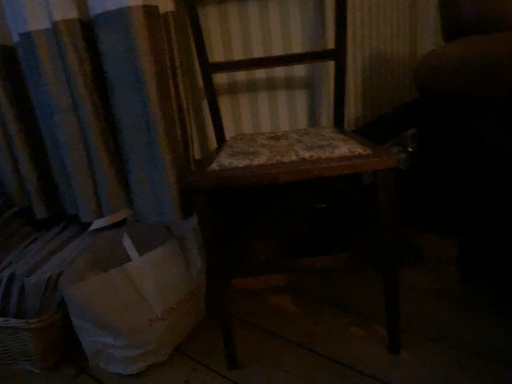
Image resolution: width=512 pixels, height=384 pixels. Describe the element at coordinates (304, 149) in the screenshot. I see `wooden chair at center` at that location.

The height and width of the screenshot is (384, 512). I want to click on wooden chair at center, so click(x=304, y=149).

Describe the element at coordinates (136, 292) in the screenshot. I see `white paper bag at lower left` at that location.

Identify the location of white paper bag at lower left. (136, 292).

The width and height of the screenshot is (512, 384). In order to click on wooden chair at center in this screenshot , I will do `click(304, 149)`.

Is wooden chair at center to the left or to the right of white paper bag at lower left in the image?

wooden chair at center is positioned on white paper bag at lower left's right side.

Relative to white paper bag at lower left, is wooden chair at center in front or behind?

wooden chair at center is positioned closer to the viewer than white paper bag at lower left.

Is point (392, 348) more distant than point (174, 268)?

No, it is in front of (174, 268).

From the image's perspective, between wooden chair at center and white paper bag at lower left, who is located below?

white paper bag at lower left appears lower in the image.

From a real-world perspective, which object stands above the other?

In real-world perspective, wooden chair at center is above.

Does wooden chair at center have a lesser width compared to white paper bag at lower left?

Incorrect, the width of wooden chair at center is not less than that of white paper bag at lower left.

Which of these two, wooden chair at center or white paper bag at lower left, stands taller?

wooden chair at center.

Who is smaller, wooden chair at center or white paper bag at lower left?

Smaller between the two is white paper bag at lower left.

Is wooden chair at center inside the boundaries of white paper bag at lower left, or outside?

wooden chair at center is located beyond the bounds of white paper bag at lower left.

Is wooden chair at center next to white paper bag at lower left?

wooden chair at center and white paper bag at lower left are clearly separated.

Is wooden chair at center turned away from white paper bag at lower left?

No, white paper bag at lower left is not at the back of wooden chair at center.

How many degrees apart are the facing directions of wooden chair at center and white paper bag at lower left?

The angle between the facing direction of wooden chair at center and the facing direction of white paper bag at lower left is 11.5 degrees.

Locate an element on the screen. This screenshot has height=384, width=512. shopping bag below the wooden chair at center (from the image's perspective) is located at coordinates (136, 292).

Which object is positioned more to the left, white paper bag at lower left or wooden chair at center?

Positioned to the left is white paper bag at lower left.

Considering the positions of objects white paper bag at lower left and wooden chair at center in the image provided, who is in front, white paper bag at lower left or wooden chair at center?

Positioned in front is wooden chair at center.

Considering the positions of points (175, 264) and (224, 152), is point (175, 264) closer to camera compared to point (224, 152)?

No, (175, 264) is behind (224, 152).

Looking at this image, from the image's perspective, who appears lower, white paper bag at lower left or wooden chair at center?

white paper bag at lower left.

From a real-world perspective, between white paper bag at lower left and wooden chair at center, who is vertically lower?

From a 3D spatial view, white paper bag at lower left is below.

Based on the photo, considering the relative sizes of white paper bag at lower left and wooden chair at center in the image provided, is white paper bag at lower left wider than wooden chair at center?

No, white paper bag at lower left is not wider than wooden chair at center.

Considering the relative sizes of white paper bag at lower left and wooden chair at center in the image provided, is white paper bag at lower left shorter than wooden chair at center?

Yes.

Can you confirm if white paper bag at lower left is smaller than wooden chair at center?

Yes, white paper bag at lower left is smaller than wooden chair at center.

Is white paper bag at lower left inside or outside of wooden chair at center?

white paper bag at lower left cannot be found inside wooden chair at center.

Is white paper bag at lower left not close to wooden chair at center?

They are positioned close to each other.

Is white paper bag at lower left facing towards wooden chair at center?

No, white paper bag at lower left does not turn towards wooden chair at center.

Measure the distance from white paper bag at lower left to wooden chair at center.

white paper bag at lower left and wooden chair at center are 9.57 inches apart from each other.

Locate an element on the screen. The image size is (512, 384). furniture in front of the white paper bag at lower left is located at coordinates (304, 149).

Find the location of a particular element. shopping bag behind the wooden chair at center is located at coordinates (136, 292).

The image size is (512, 384). I want to click on shopping bag below the wooden chair at center (from the image's perspective), so click(136, 292).